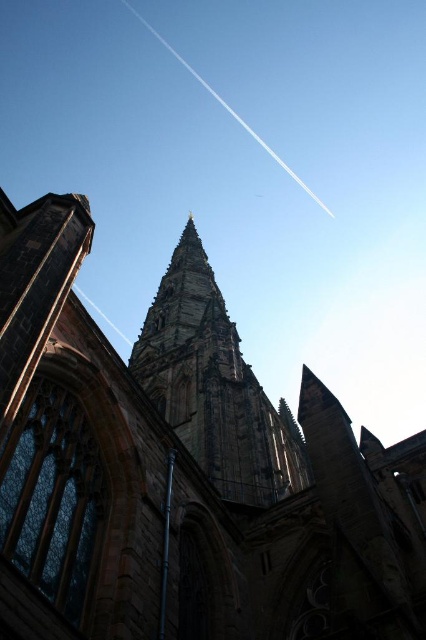
Question: Which point is closer to the camera taking this photo?

Choices:
 (A) (164, 394)
 (B) (339, 488)

Answer: (B)

Question: Does dark gray stone church steeple at center come behind dark gray stone tower at center?

Choices:
 (A) yes
 (B) no

Answer: (B)

Question: Can you confirm if dark gray stone church steeple at center is thinner than dark gray stone tower at center?

Choices:
 (A) no
 (B) yes

Answer: (A)

Question: Can you confirm if dark gray stone church steeple at center is positioned below dark gray stone tower at center?

Choices:
 (A) yes
 (B) no

Answer: (B)